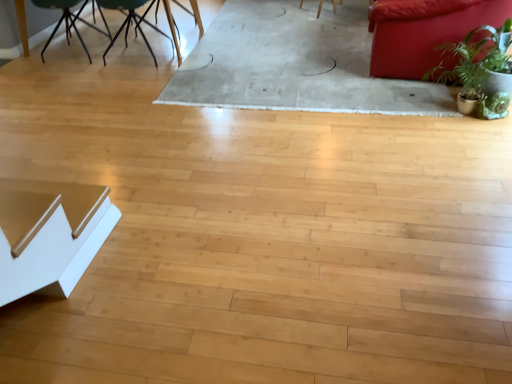
This screenshot has width=512, height=384. In order to click on free space in front of white glossy table at lower left in this screenshot , I will do `click(36, 344)`.